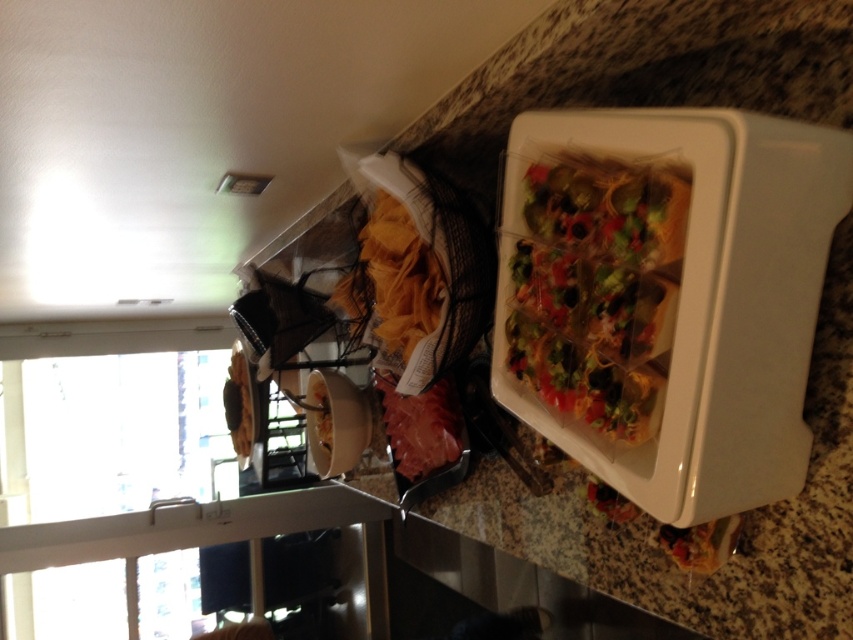
Question: Among these objects, which one is nearest to the camera?

Choices:
 (A) translucent plastic containers at upper right
 (B) white matte bowl at center

Answer: (A)

Question: Is translucent plastic containers at upper right to the right of white matte bowl at center from the viewer's perspective?

Choices:
 (A) yes
 (B) no

Answer: (A)

Question: Among these objects, which one is nearest to the camera?

Choices:
 (A) translucent plastic containers at upper right
 (B) white matte bowl at center

Answer: (A)

Question: Among these objects, which one is nearest to the camera?

Choices:
 (A) translucent plastic containers at upper right
 (B) white matte bowl at center

Answer: (A)

Question: From the image, what is the correct spatial relationship of translucent plastic containers at upper right in relation to white matte bowl at center?

Choices:
 (A) below
 (B) above

Answer: (B)

Question: Is translucent plastic containers at upper right below white matte bowl at center?

Choices:
 (A) yes
 (B) no

Answer: (B)